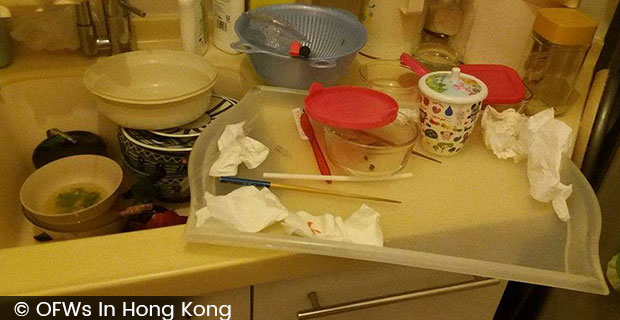
You are a GUI agent. You are given a task and a screenshot of the screen. Output one action in this format:
    pyautogui.click(x=<x>, y=<y>)
    Task: Click on the counter
    
    Given the screenshot: What is the action you would take?
    pyautogui.click(x=139, y=259)